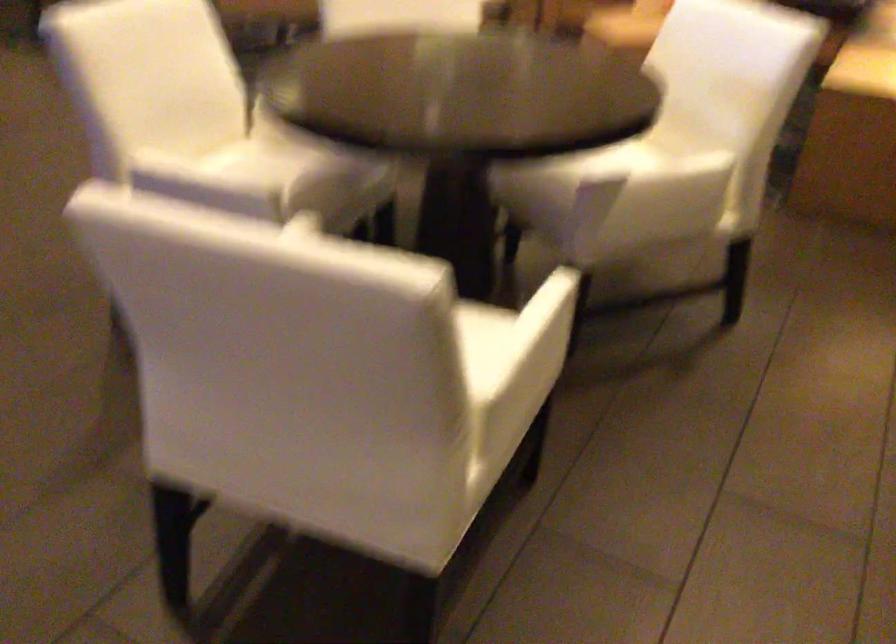
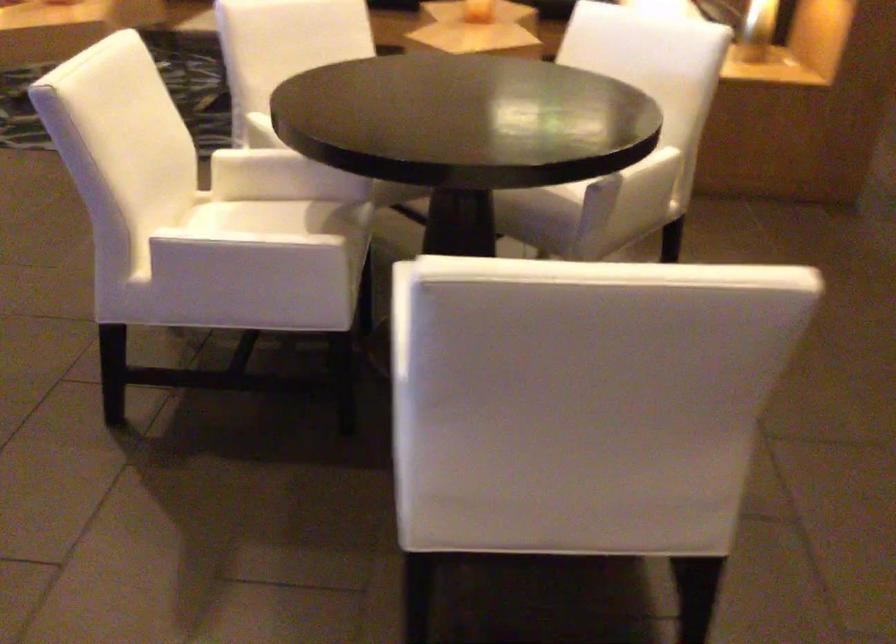
Question: The camera is either moving clockwise (left) or counter-clockwise (right) around the object. The first image is from the beginning of the video and the second image is from the end. Is the camera moving left or right when shooting the video?

Choices:
 (A) Left
 (B) Right

Answer: (A)